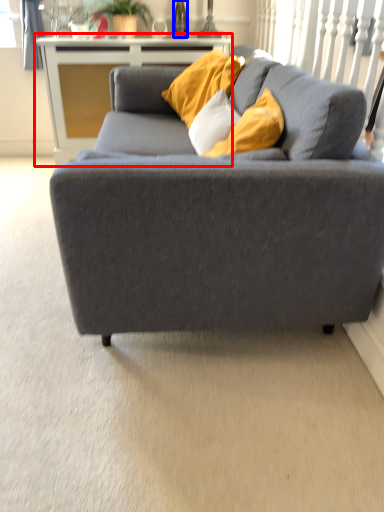
Question: Which of the following is the closest to the observer, table (highlighted by a red box) or wine bottle (highlighted by a blue box)?

Choices:
 (A) table
 (B) wine bottle

Answer: (A)